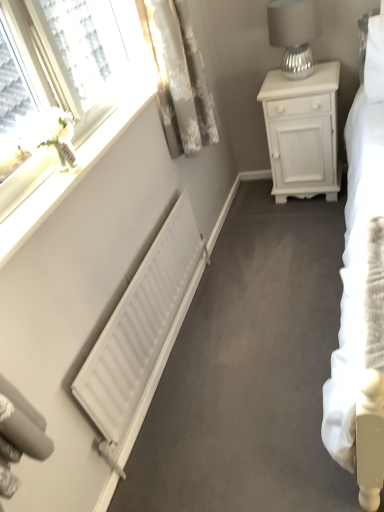
Question: Would you say white matte nightstand at upper right is to the left or to the right of white textured curtain at upper left in the picture?

Choices:
 (A) right
 (B) left

Answer: (A)

Question: From a real-world perspective, relative to white textured curtain at upper left, is white matte nightstand at upper right vertically above or below?

Choices:
 (A) below
 (B) above

Answer: (A)

Question: Estimate the real-world distances between objects in this image. Which object is closer to the white matte radiator at lower left?

Choices:
 (A) white glossy flower at upper left
 (B) white glossy window sill at upper left
 (C) white matte nightstand at upper right
 (D) silver textured lampshade at upper right
 (E) white textured curtain at upper left

Answer: (B)

Question: Which object is positioned farthest from the white textured curtain at upper left?

Choices:
 (A) white glossy flower at upper left
 (B) silver textured lampshade at upper right
 (C) white matte radiator at lower left
 (D) white glossy window sill at upper left
 (E) white matte nightstand at upper right

Answer: (C)